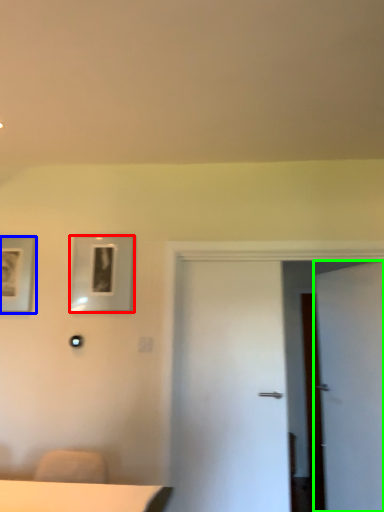
Question: Estimate the real-world distances between objects in this image. Which object is farther from picture frame (highlighted by a red box), picture frame (highlighted by a blue box) or door (highlighted by a green box)?

Choices:
 (A) picture frame
 (B) door

Answer: (B)